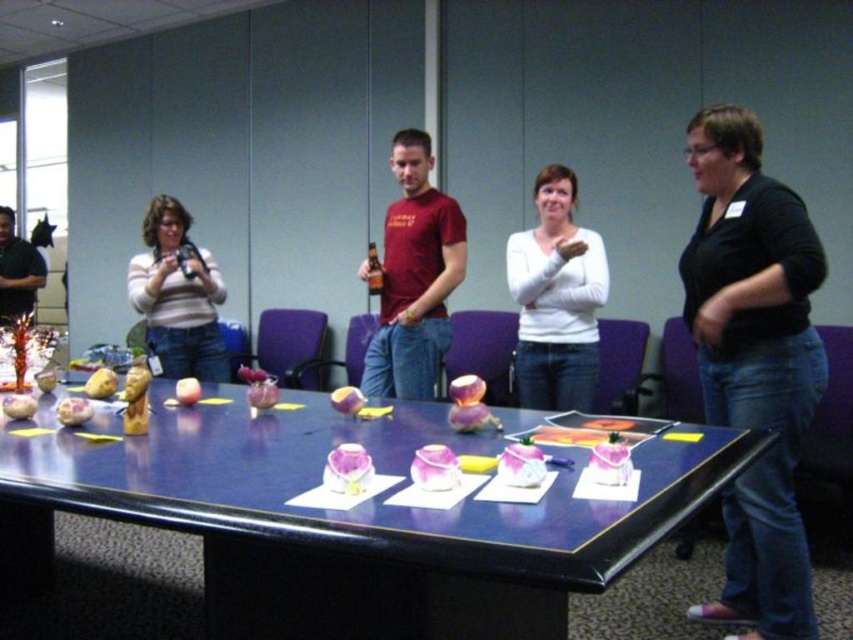
You are standing in front of the conference table with the dark blue surface. You see two points marked on the table surface at coordinates point [550,301] and point [358,403]. If you want to reach the point that is closer to you, which coordinate should you move towards?

You should move towards point [358,403] because it is closer to you than point [550,301], which is further away.